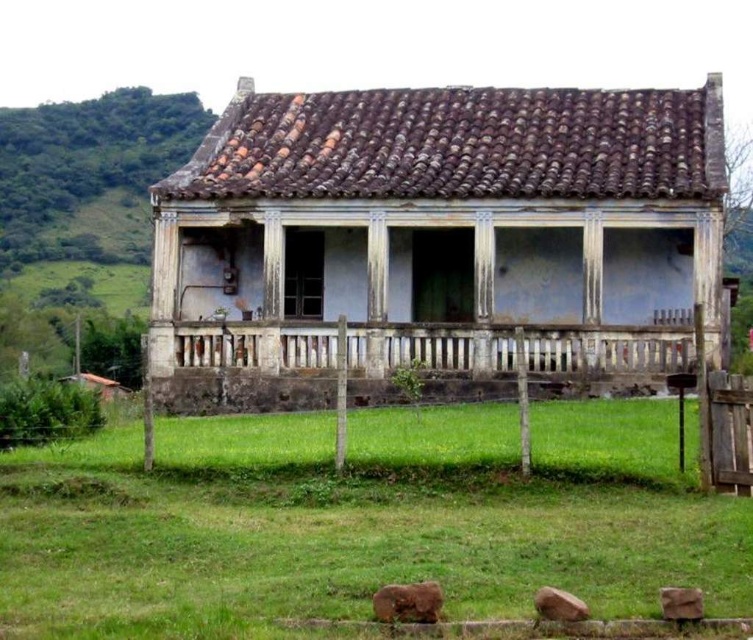
You are standing in front of the house and want to walk towards the white weathered wood porch at center. Which direction should you walk relative to the green grass at lower center?

Since the green grass at lower center is to the left of the white weathered wood porch at center, you should walk to the right relative to the green grass at lower center to reach the porch.

You are a gardener planning to mow the lawn. You see the green grass at lower center and the white weathered wood porch at center. Which area is narrower in width?

The green grass at lower center has a narrower width compared to the white weathered wood porch at center, as stated in the description.